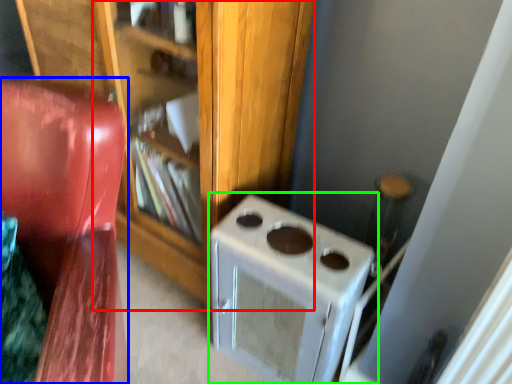
Question: Which is nearer to the bookshelf (highlighted by a red box)? furniture (highlighted by a blue box) or home appliance (highlighted by a green box).

Choices:
 (A) furniture
 (B) home appliance

Answer: (B)